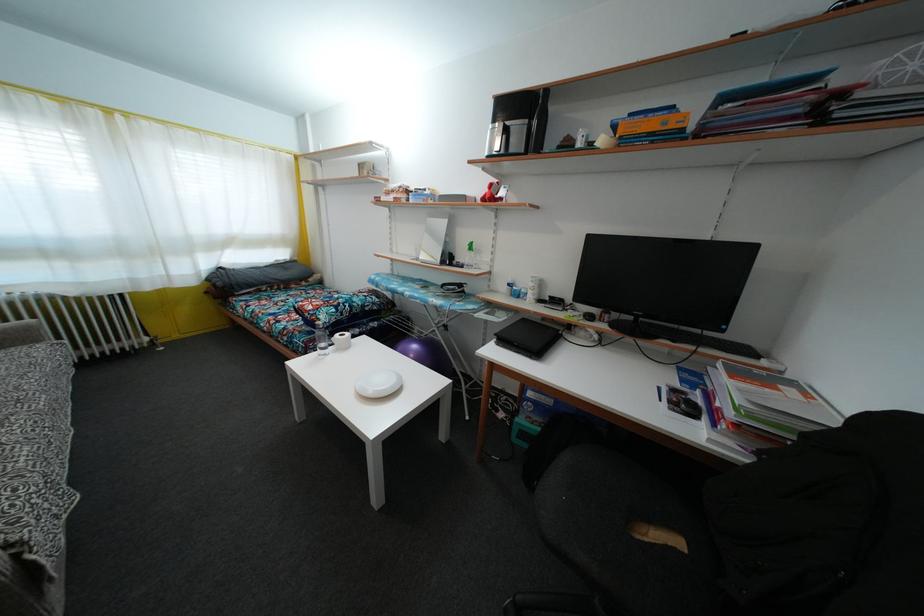
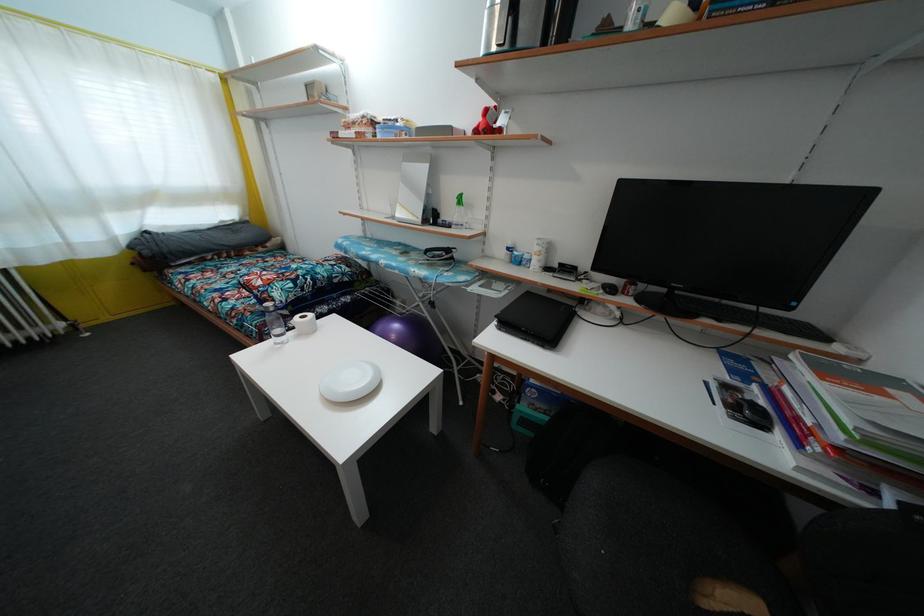
In the second image, find the point that corresponds to point 310,321 in the first image.

(259, 299)